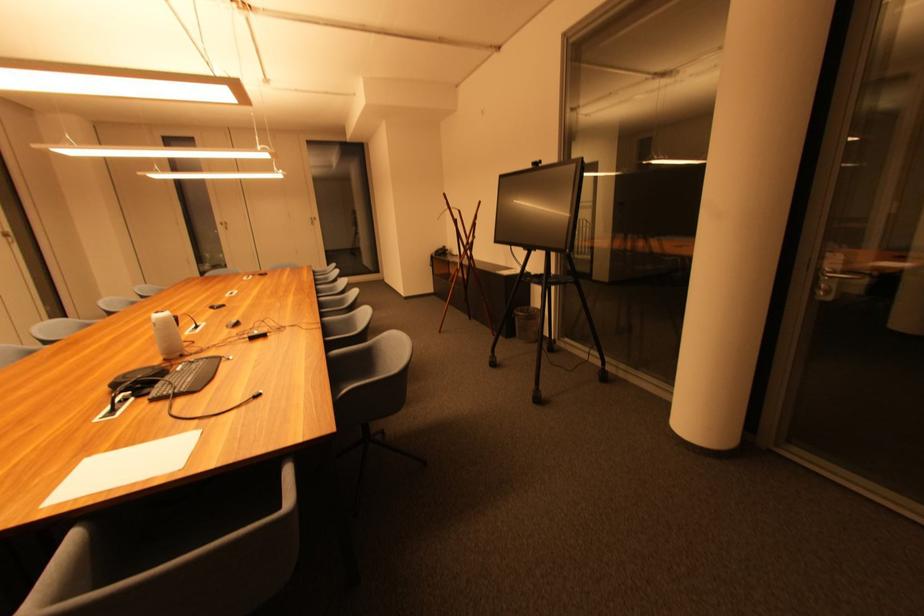
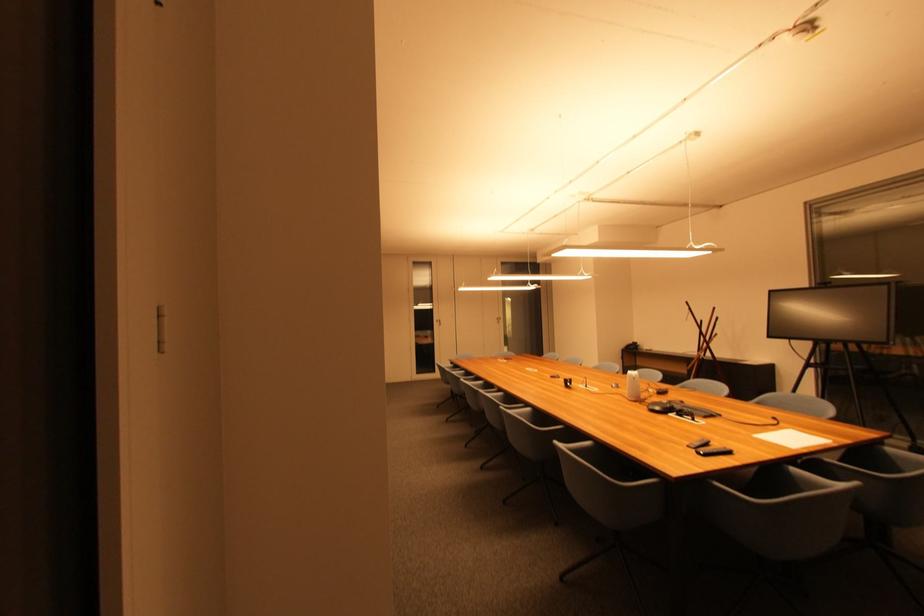
Which direction would the cameraman need to move to produce the second image?

The movement direction of the cameraman is left, backward.